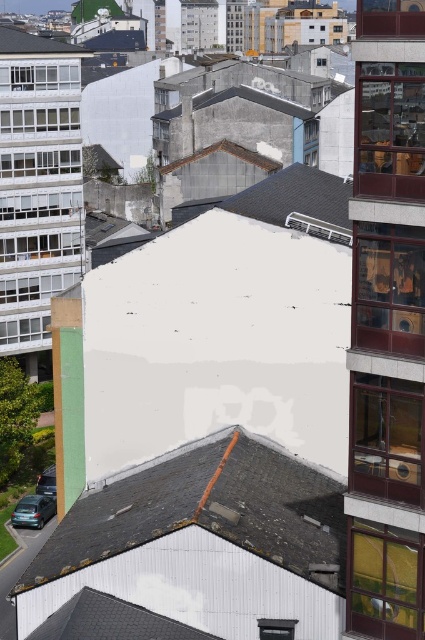
Can you confirm if metallic silver car at lower left is wider than shiny black car at lower left?

Yes, metallic silver car at lower left is wider than shiny black car at lower left.

Between metallic silver car at lower left and shiny black car at lower left, which one appears on the left side from the viewer's perspective?

From the viewer's perspective, metallic silver car at lower left appears more on the left side.

Image resolution: width=425 pixels, height=640 pixels. What do you see at coordinates (33, 512) in the screenshot?
I see `metallic silver car at lower left` at bounding box center [33, 512].

At what (x,y) coordinates should I click in order to perform the action: click on metallic silver car at lower left. Please return your answer as a coordinate pair (x, y). Looking at the image, I should click on (33, 512).

Can you confirm if white shingles at upper left is wider than shiny black car at lower left?

Yes, white shingles at upper left is wider than shiny black car at lower left.

Is white shingles at upper left taller than shiny black car at lower left?

Yes.

Describe the element at coordinates (34, 44) in the screenshot. I see `white shingles at upper left` at that location.

Find the location of a particular element. The width and height of the screenshot is (425, 640). white shingles at upper left is located at coordinates (34, 44).

Is gray slate roof at lower left smaller than shiny black car at lower left?

No, gray slate roof at lower left is not smaller than shiny black car at lower left.

Which is in front, point (84, 614) or point (53, 483)?

Point (84, 614) is in front.

The width and height of the screenshot is (425, 640). I want to click on gray slate roof at lower left, so click(x=110, y=621).